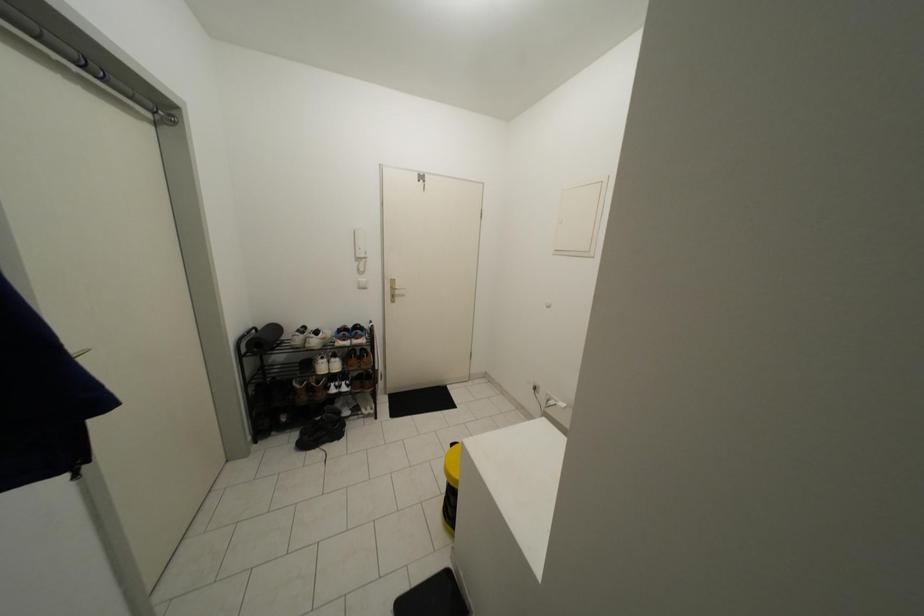
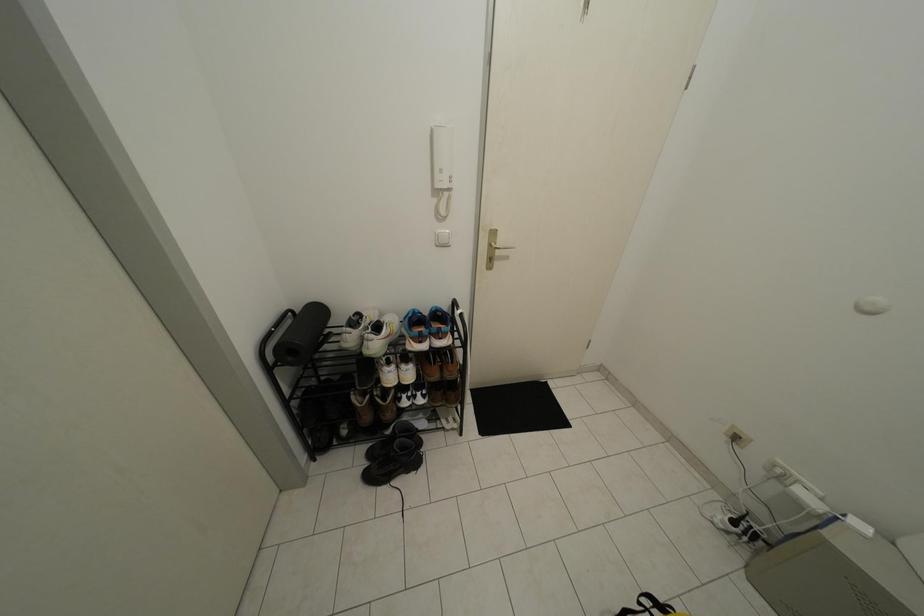
Which direction would the cameraman need to move to produce the second image?

The movement direction of the cameraman is left, forward.